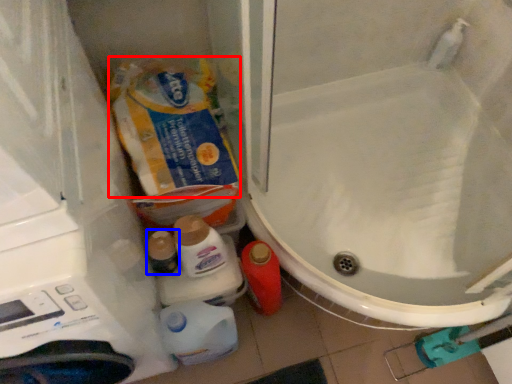
Question: Among these objects, which one is nearest to the camera, product (highlighted by a red box) or toiletry (highlighted by a blue box)?

Choices:
 (A) product
 (B) toiletry

Answer: (A)